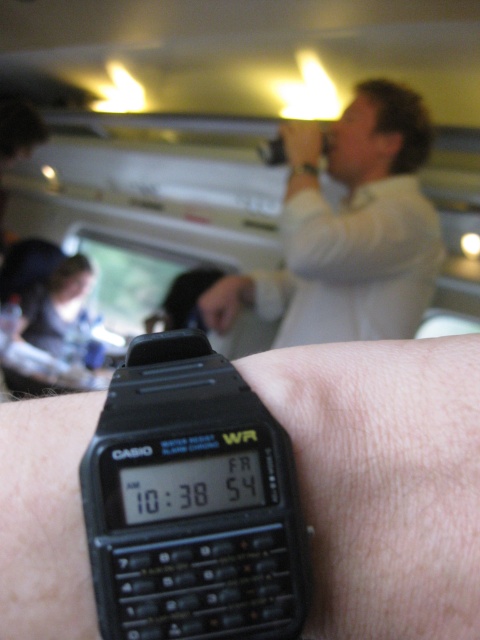
Question: Is black plastic calculator at center positioned at the back of matte black watch at center?

Choices:
 (A) yes
 (B) no

Answer: (B)

Question: Is black plastic watch at center wider than black plastic calculator at center?

Choices:
 (A) no
 (B) yes

Answer: (B)

Question: Which object is positioned farthest from the matte black watch at center?

Choices:
 (A) black plastic watch at center
 (B) black plastic calculator at center
 (C) white matte shirt at upper center

Answer: (A)

Question: Which object is the closest to the black plastic calculator at center?

Choices:
 (A) black plastic watch at center
 (B) matte black watch at center

Answer: (A)

Question: Does white matte shirt at upper center appear over matte black watch at center?

Choices:
 (A) no
 (B) yes

Answer: (B)

Question: Which of the following is the farthest from the observer?

Choices:
 (A) (359, 556)
 (B) (301, 166)
 (C) (200, 518)

Answer: (B)